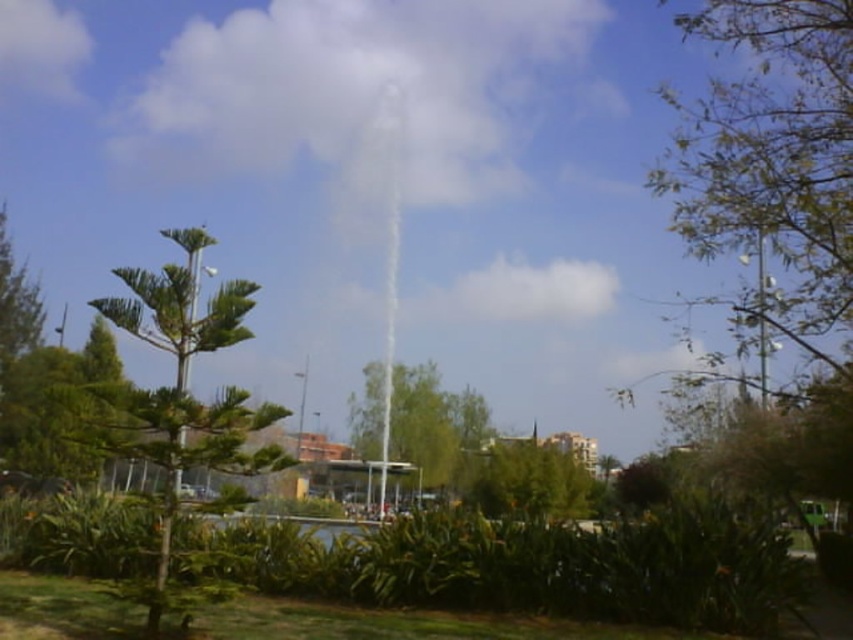
Question: Can you confirm if green leafy tree at left is thinner than green leafy tree at center?

Choices:
 (A) yes
 (B) no

Answer: (B)

Question: Observing the image, what is the correct spatial positioning of green leafy tree at right in reference to green leafy tree at left?

Choices:
 (A) below
 (B) above

Answer: (B)

Question: Which point is farther to the camera?

Choices:
 (A) pos(703,145)
 (B) pos(202,234)

Answer: (A)

Question: Which object is positioned closest to the green leafy tree at center?

Choices:
 (A) green leafy tree at right
 (B) green leafy tree at left

Answer: (B)

Question: From the image, what is the correct spatial relationship of green leafy tree at right in relation to green leafy tree at left?

Choices:
 (A) left
 (B) right

Answer: (B)

Question: Which of the following is the closest to the observer?

Choices:
 (A) green leafy tree at right
 (B) green leafy tree at center
 (C) green leafy tree at left

Answer: (C)